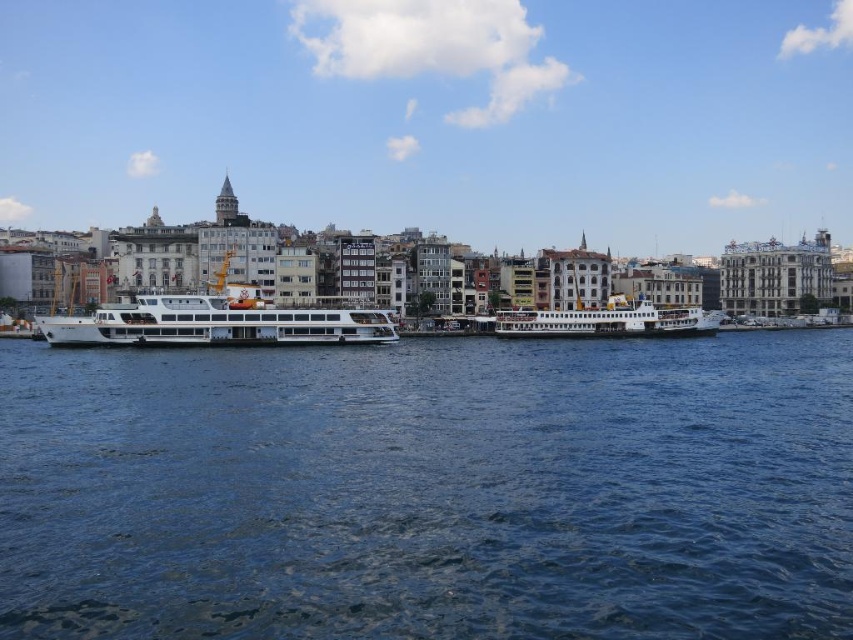
Does blue water at center lie in front of white glossy ferry at center?

Yes, it is.

Which is more to the right, blue water at center or white glossy ferry at center?

white glossy ferry at center is more to the right.

Who is more forward, (598, 340) or (630, 323)?

Positioned in front is point (630, 323).

Locate an element on the screen. blue water at center is located at coordinates (428, 490).

Between white glossy cruise ship at center and white glossy ferry at center, which one has less height?

white glossy cruise ship at center is shorter.

Is white glossy cruise ship at center thinner than white glossy ferry at center?

No.

I want to click on white glossy cruise ship at center, so click(x=213, y=324).

Is blue water at center thinner than white glossy cruise ship at center?

No, blue water at center is not thinner than white glossy cruise ship at center.

Consider the image. Does blue water at center appear over white glossy cruise ship at center?

Incorrect, blue water at center is not positioned above white glossy cruise ship at center.

Who is more forward, (785, 566) or (71, 337)?

Positioned in front is point (785, 566).

I want to click on blue water at center, so click(x=428, y=490).